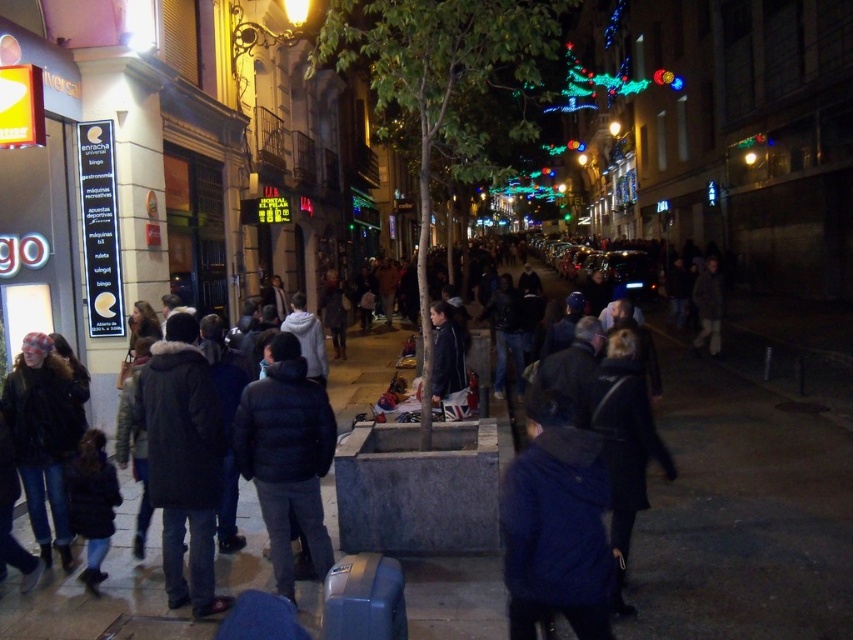
Question: Is concrete sidewalk at center wider than blue fuzzy jacket at center?

Choices:
 (A) no
 (B) yes

Answer: (B)

Question: Which of the following is the closest to the observer?

Choices:
 (A) (285, 492)
 (B) (822, 556)

Answer: (A)

Question: Which object appears closest to the camera in this image?

Choices:
 (A) blue fuzzy jacket at center
 (B) concrete sidewalk at center

Answer: (A)

Question: Does concrete sidewalk at center have a larger size compared to black puffy jacket at center?

Choices:
 (A) no
 (B) yes

Answer: (B)

Question: Is blue fuzzy jacket at center further to camera compared to black puffy jacket at center?

Choices:
 (A) yes
 (B) no

Answer: (B)

Question: Based on their relative distances, which object is farther from the black puffy jacket at center?

Choices:
 (A) blue fuzzy jacket at center
 (B) concrete sidewalk at center

Answer: (B)